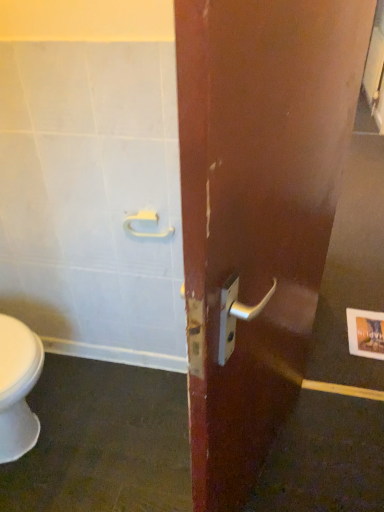
What are the coordinates of `vacant space underneath matte brown door at center (from a real-world perspective)` in the screenshot? It's located at (274, 459).